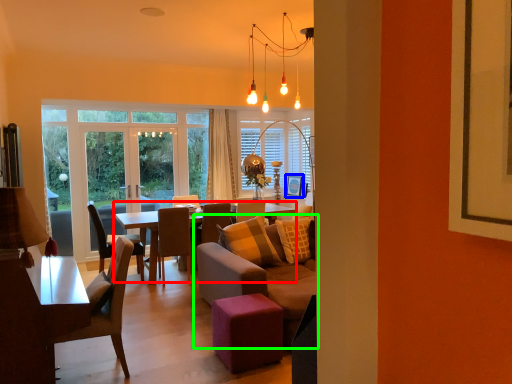
Question: Considering the real-world distances, which object is closest to coffee table (highlighted by a red box)? picture frame (highlighted by a blue box) or studio couch (highlighted by a green box).

Choices:
 (A) picture frame
 (B) studio couch

Answer: (B)